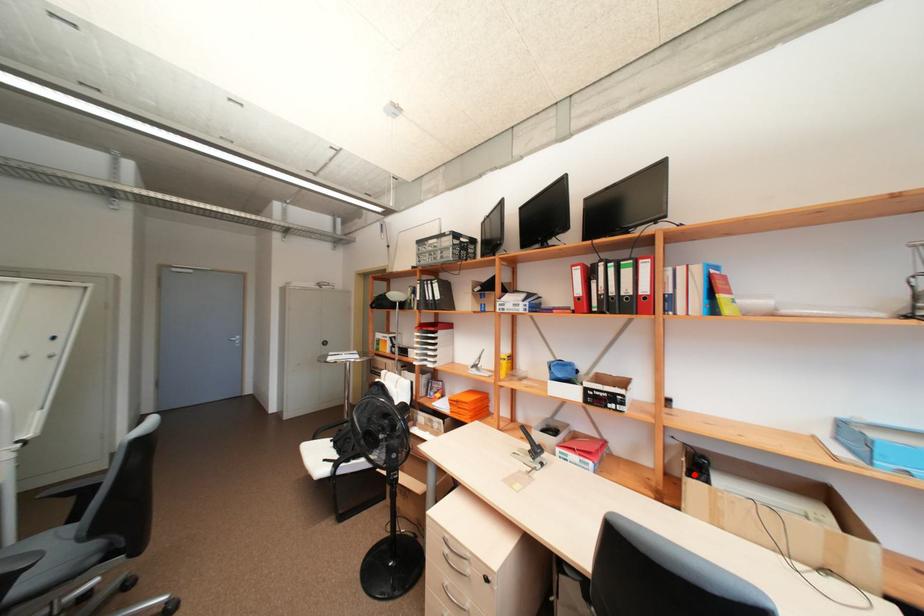
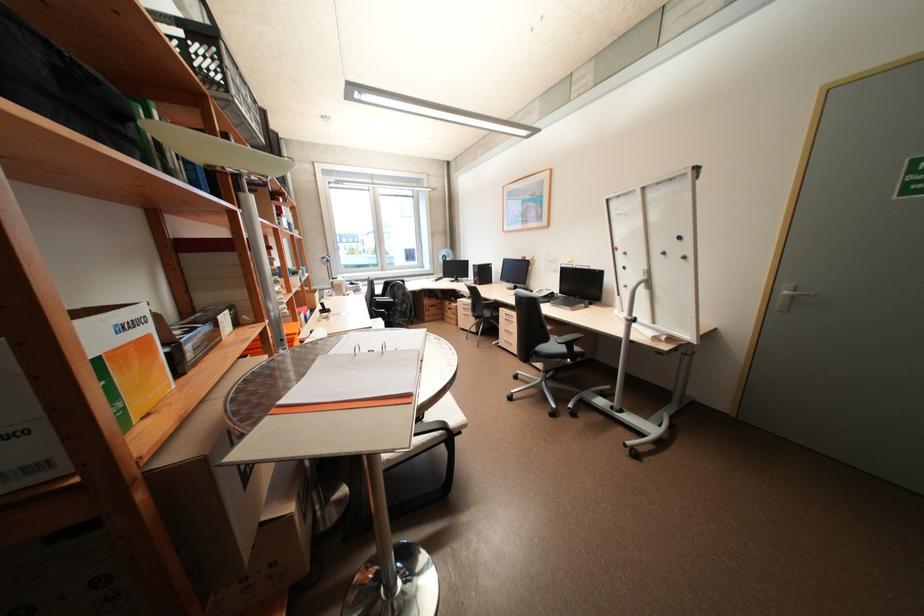
Question: I am providing you with two images of the same scene from different viewpoints. A red point is marked on the first image. At the location where the point appears in image 1, is it still visible in image 2?

Choices:
 (A) Yes
 (B) No

Answer: (B)